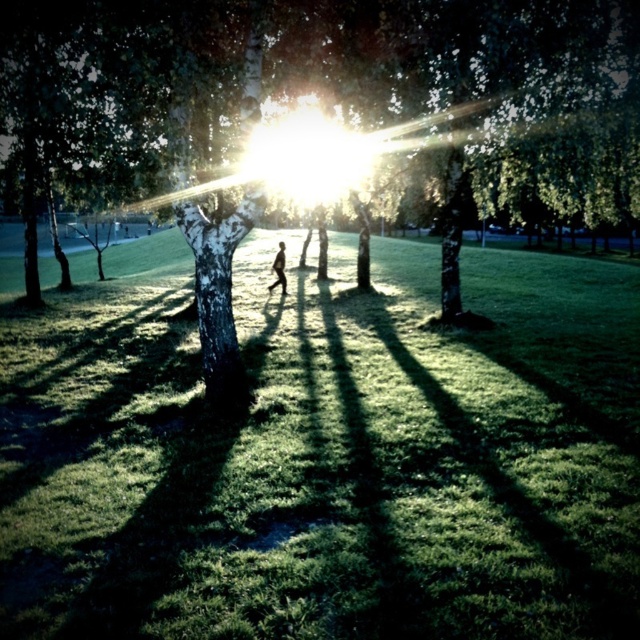
You are standing in the park and want to take a photo of the green matte tree at center. You notice that the sun is causing a bright glare at point (371, 113). Should you adjust your camera position to avoid the glare when taking the photo of the green matte tree at center?

The green matte tree at center is located at point (371, 113) where the sun is causing a bright glare. To avoid the glare, you should adjust your camera position away from that point.

You are standing in the park and want to take a photo of the green grassy at center and the green matte tree at center. Which object will appear taller in the photo?

The green matte tree at center will appear taller in the photo because it is taller than the green grassy at center.

You are a photographer trying to capture a clear photo of the dark skin person at center. However, the green matte tree at center is blocking your view. Can you move to the side to get a clear shot without the tree blocking the person?

The green matte tree at center is in front of the dark skin person at center, so moving to the side might allow you to see around the tree and capture the person without obstruction.